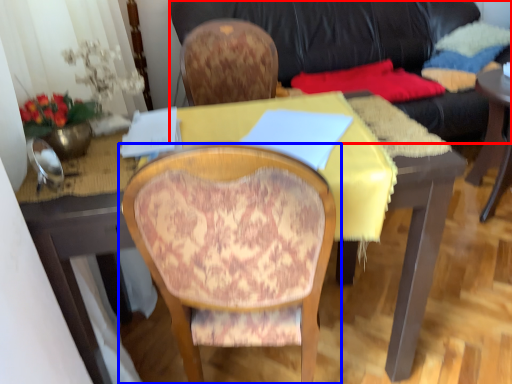
Question: Which object appears closest to the camera in this image, studio couch (highlighted by a red box) or chair (highlighted by a blue box)?

Choices:
 (A) studio couch
 (B) chair

Answer: (B)